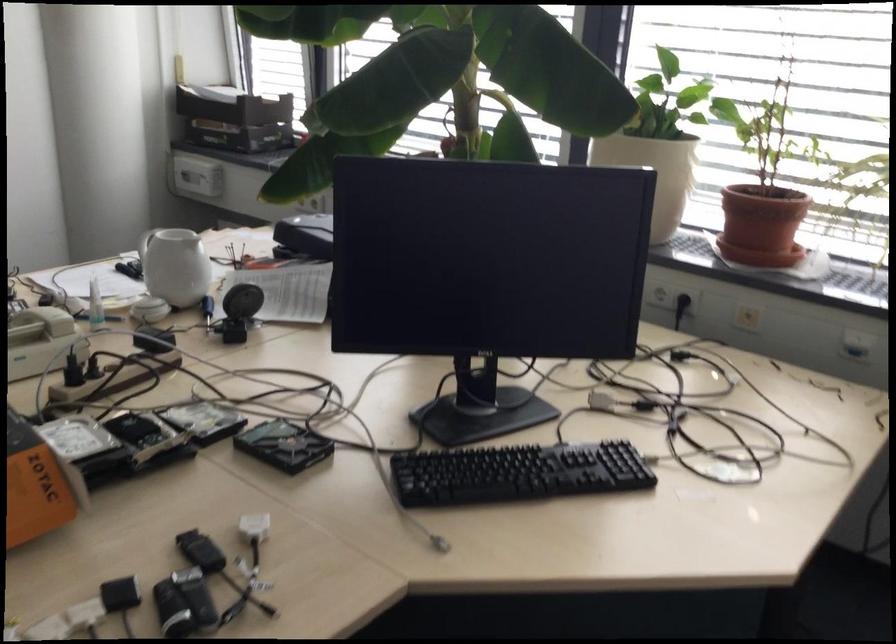
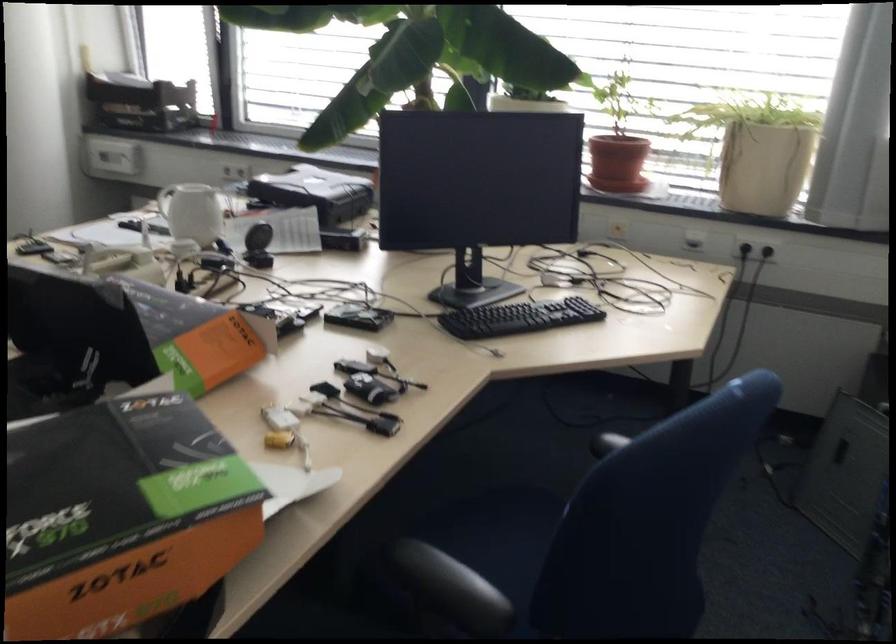
The point at (147, 245) is marked in the first image. Where is the corresponding point in the second image?

(165, 200)